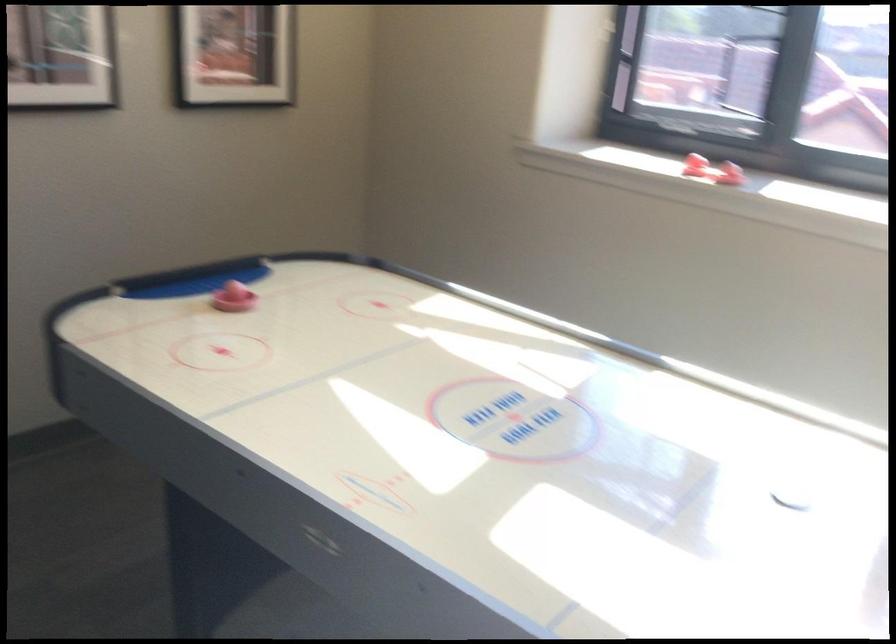
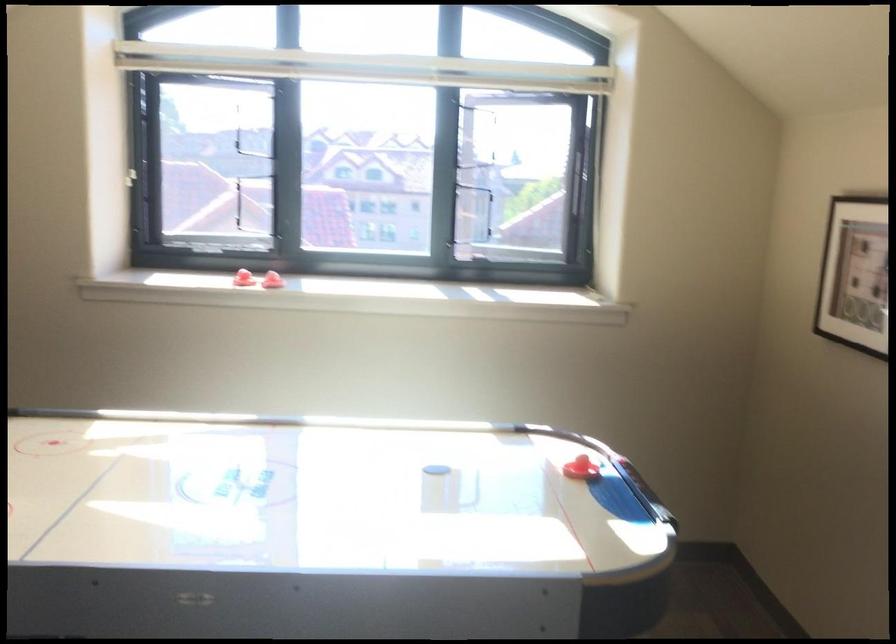
Where in the second image is the point corresponding to pixel 692 171 from the first image?

(244, 279)